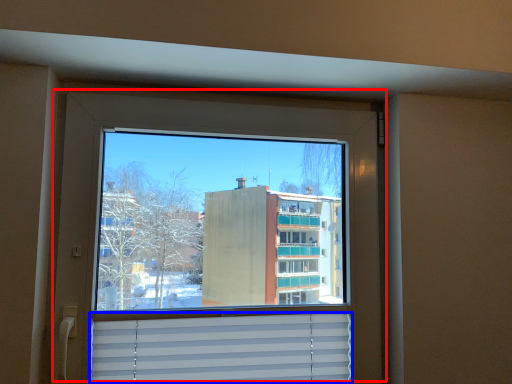
Question: Which point is closer to the camera, window (highlighted by a red box) or shutter (highlighted by a blue box)?

Choices:
 (A) window
 (B) shutter

Answer: (A)